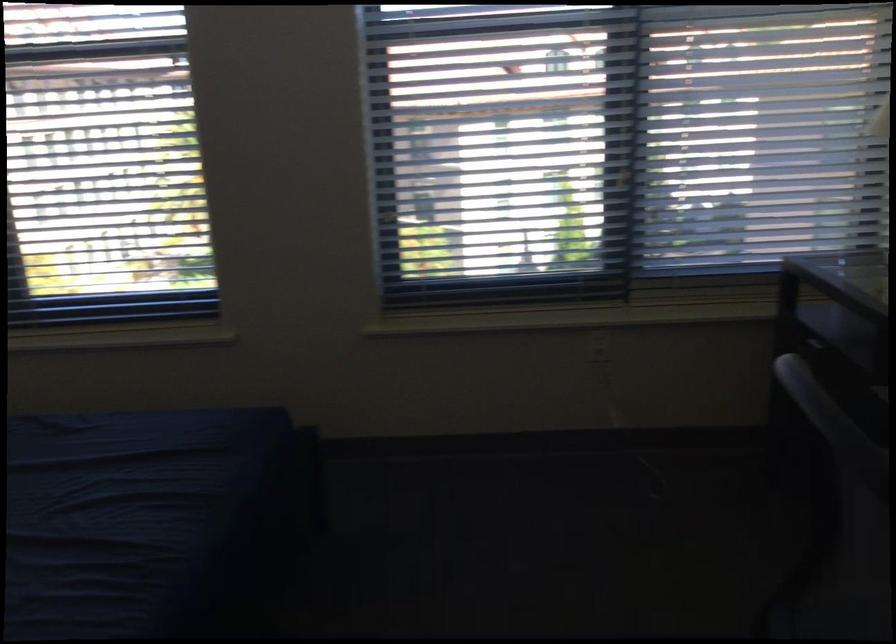
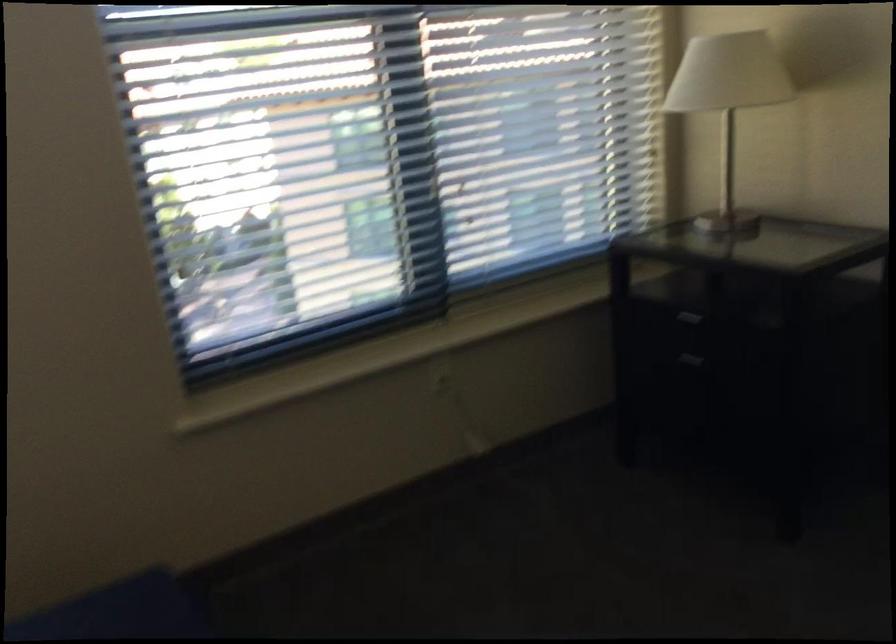
Locate, in the second image, the point that corresponds to point 813,357 in the first image.

(682, 330)